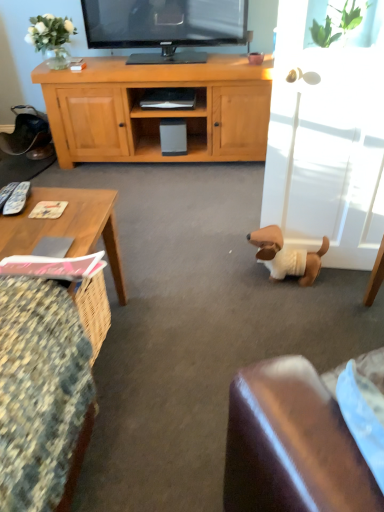
The image size is (384, 512). Find the location of `vacant region in front of white plush dog at lower right`. vacant region in front of white plush dog at lower right is located at coordinates (298, 309).